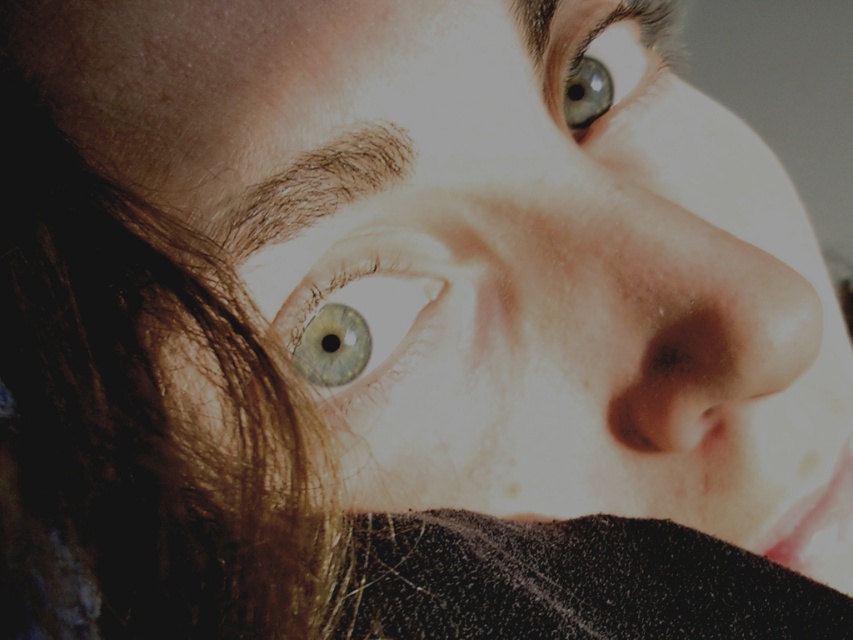
Question: Considering the real-world distances, which object is farthest from the matte blue eye at upper center?

Choices:
 (A) brown hair at upper center
 (B) light blue glossy eye at center

Answer: (A)

Question: Which point is closer to the camera taking this photo?

Choices:
 (A) (335, 179)
 (B) (564, 80)

Answer: (A)

Question: Does light blue glossy eye at center appear on the right side of matte blue eye at upper center?

Choices:
 (A) yes
 (B) no

Answer: (B)

Question: Is light blue glossy eye at center closer to the viewer compared to brown hair at upper center?

Choices:
 (A) no
 (B) yes

Answer: (A)

Question: Which is farther from the brown hair at upper center?

Choices:
 (A) light blue glossy eye at center
 (B) matte blue eye at upper center

Answer: (B)

Question: Is light blue glossy eye at center bigger than matte blue eye at upper center?

Choices:
 (A) no
 (B) yes

Answer: (A)